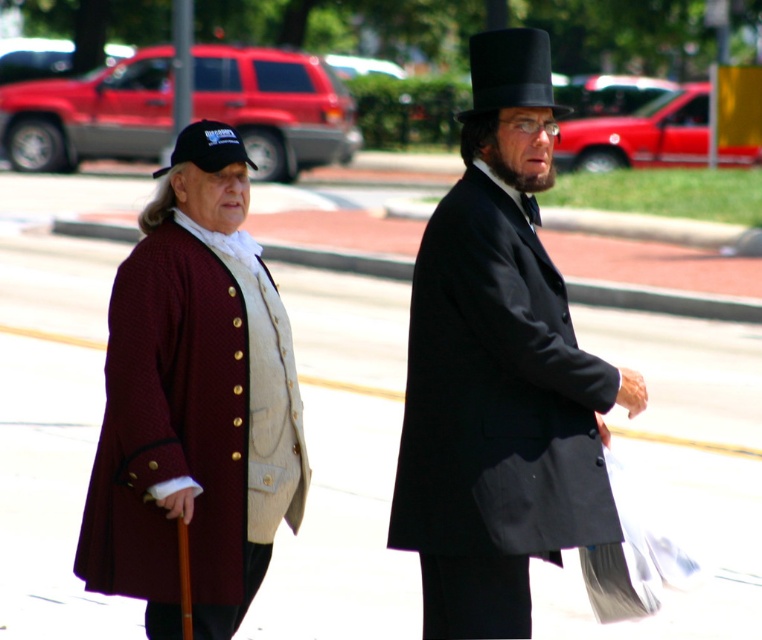
Which is more to the right, maroon wool coat at left or black felt top hat at upper center?

Positioned to the right is black felt top hat at upper center.

The image size is (762, 640). What do you see at coordinates (194, 403) in the screenshot? I see `maroon wool coat at left` at bounding box center [194, 403].

Is point (168, 262) behind point (517, 106)?

Yes, point (168, 262) is behind point (517, 106).

Find the location of a particular element. maroon wool coat at left is located at coordinates (194, 403).

Is maroon wool coat at center thinner than matte black coat at center?

No.

Where is `maroon wool coat at center`? The width and height of the screenshot is (762, 640). maroon wool coat at center is located at coordinates (498, 396).

Does point (466, 616) lie behind point (514, 236)?

No.

The height and width of the screenshot is (640, 762). In order to click on maroon wool coat at center in this screenshot , I will do `click(498, 396)`.

Which is below, maroon wool coat at left or black fabric cap at left?

maroon wool coat at left is lower down.

Does maroon wool coat at left have a greater height compared to black fabric cap at left?

No, maroon wool coat at left is not taller than black fabric cap at left.

Which is in front, point (226, 156) or point (197, 147)?

Point (197, 147)

This screenshot has width=762, height=640. Identify the location of maroon wool coat at left. (194, 403).